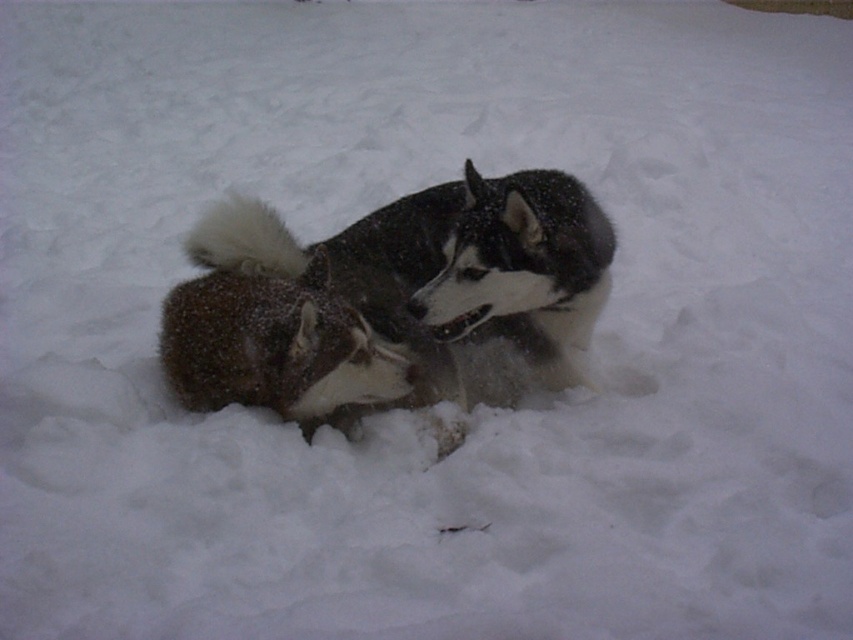
You are a photographer trying to capture the black and white fur dog at center in the snowy environment. The camera has a focus point at coordinates 0.467, 0.454. Will the focus point align with the dog?

Yes, the focus point at coordinates (386,298) will align with the black and white fur dog at center because its 2D location is exactly at point (386,298).

You are a photographer standing in the snow with your camera. You want to take a closeup photo of the black and white fur dog at center. Given that your camera can focus on subjects within 2 meters, will you need to move closer or farther away to achieve a clear focus?

The black and white fur dog at center is 2.72 meters away from the camera. Since your camera focuses within 2 meters, you need to move closer to the dog to be within the 2 meter range for clear focus.